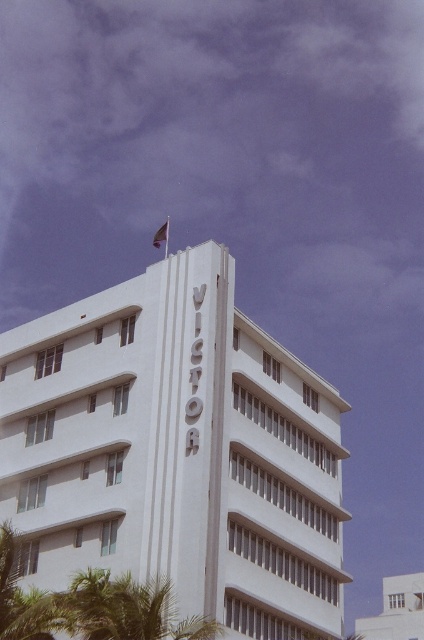
Question: Which point is farther to the camera?

Choices:
 (A) (203, 506)
 (B) (166, 234)

Answer: (B)

Question: Can you confirm if white smooth building at center is positioned below silky red flag at upper center?

Choices:
 (A) no
 (B) yes

Answer: (B)

Question: Where is white smooth building at center located in relation to silky red flag at upper center in the image?

Choices:
 (A) below
 (B) above

Answer: (A)

Question: Which of the following is the closest to the observer?

Choices:
 (A) silky red flag at upper center
 (B) white smooth building at center

Answer: (B)

Question: Which object appears closest to the camera in this image?

Choices:
 (A) white smooth building at center
 (B) silky red flag at upper center

Answer: (A)

Question: Can you confirm if white smooth building at center is smaller than silky red flag at upper center?

Choices:
 (A) no
 (B) yes

Answer: (A)